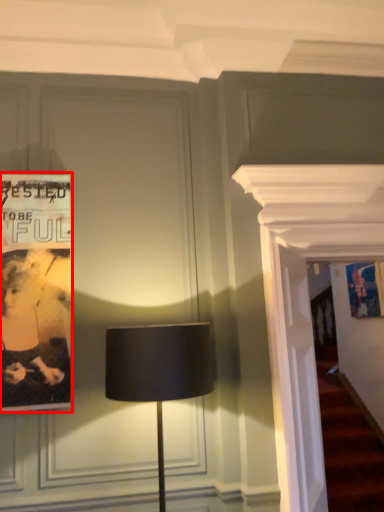
Question: Observing the image, what is the correct spatial positioning of poster (annotated by the red box) in reference to lamp?

Choices:
 (A) left
 (B) right

Answer: (A)